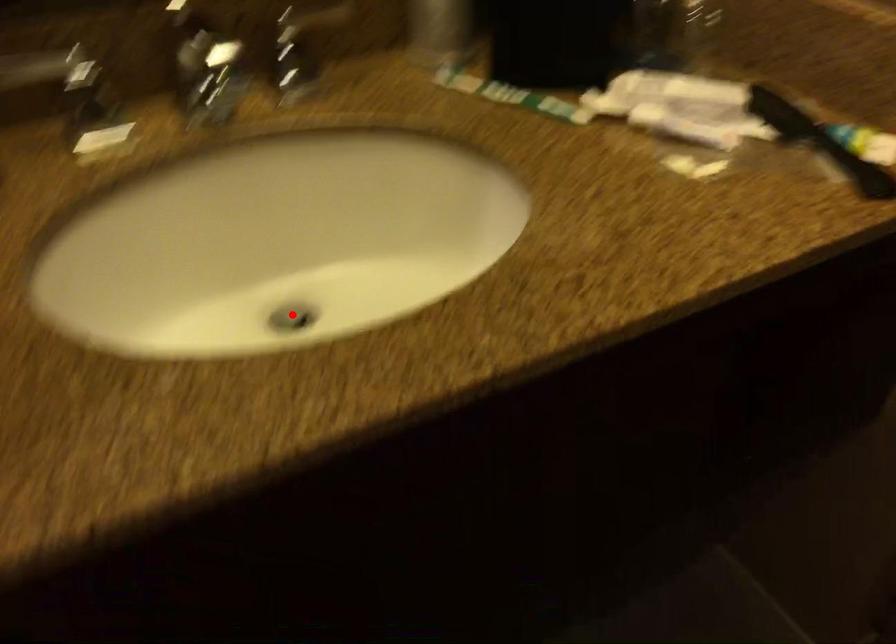
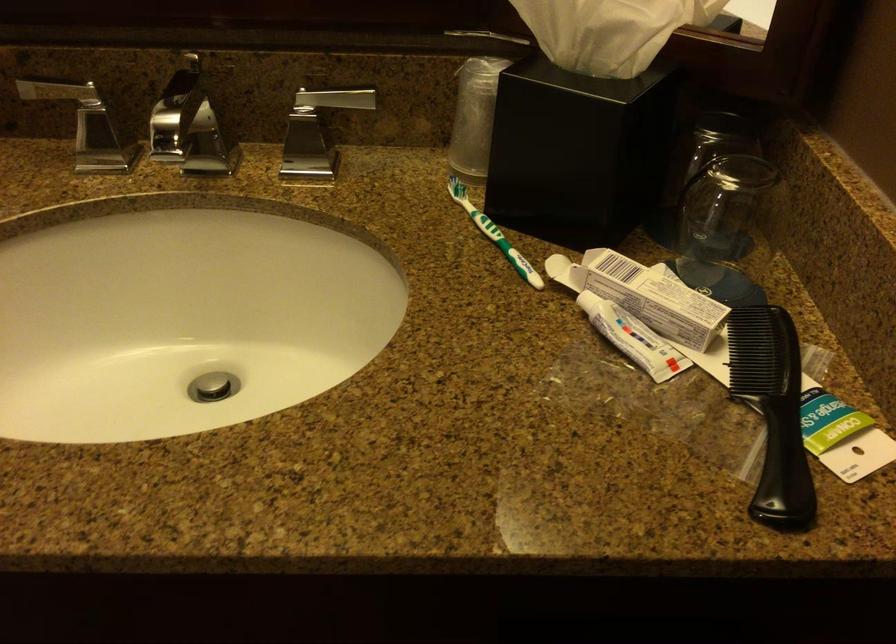
Where in the second image is the point corresponding to the highlighted location from the first image?

(212, 386)